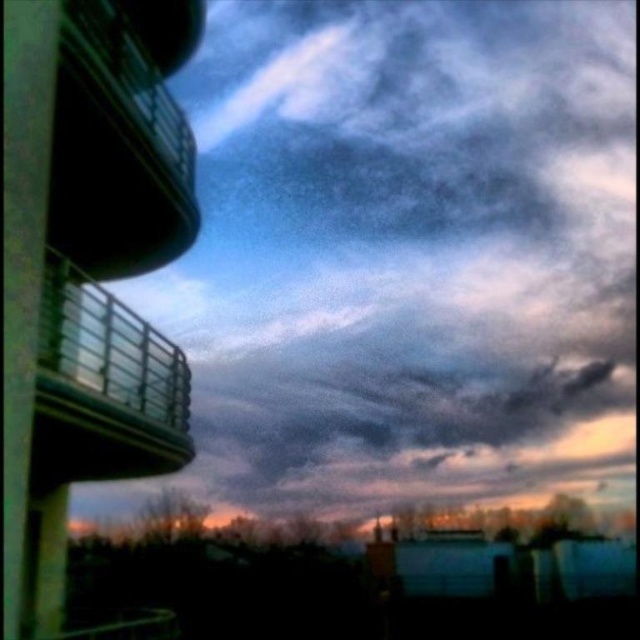
You are an astronomer observing the sky scene. You notice two points in the sky labeled as point (168, 132) and point (118, 422). Based on their positions, which point is closer to the horizon?

Point (118, 422) is closer to the horizon because it has a lower y coordinate than point (168, 132).

You are standing on the ground floor of a building and see both the metallic balcony at left and the metallic glass balcony at upper left. Which balcony is closer to the ground floor?

The metallic balcony at left is closer to the ground floor because it is shorter than the metallic glass balcony at upper left, meaning it is positioned lower.

You are standing on the curved balcony railing structure and want to move to the other balcony. Which balcony should you ascend to reach the metallic balcony at left from the metallic glass balcony at upper left?

You should ascend to reach the metallic balcony at left because it is located above the metallic glass balcony at upper left.